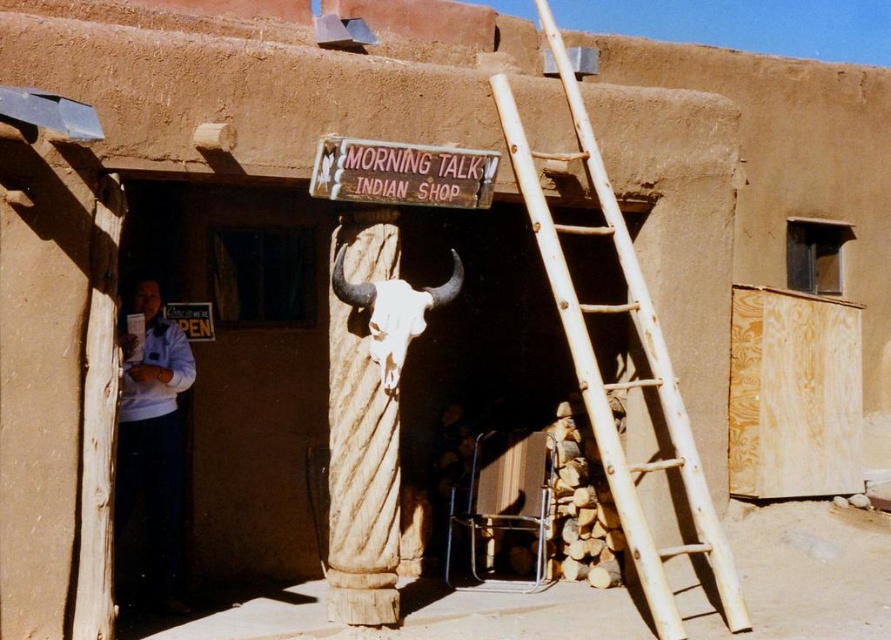
You are standing in front of the adobe building and want to take a photo. You notice two points marked on the image at coordinates point (390, 147) and point (393, 342). Which point should you focus on if you want to capture the closest part of the building to your camera in your photo?

Point (390, 147) is closer to the camera than point (393, 342), so you should focus on point (390, 147) to capture the closest part of the building to your camera.

You are a traveler approaching the rustic adobe building and notice the white cotton shirt at left and the wooden sign at center. Which object is narrower?

The white cotton shirt at left is narrower than the wooden sign at center.

You are standing in front of the adobe building and want to determine which of the two points, point (164, 563) or point (446, 195), is closer to you. Based on the scene, which point is nearer?

Point (164, 563) is closer to you because it is further to the viewer than point (446, 195).